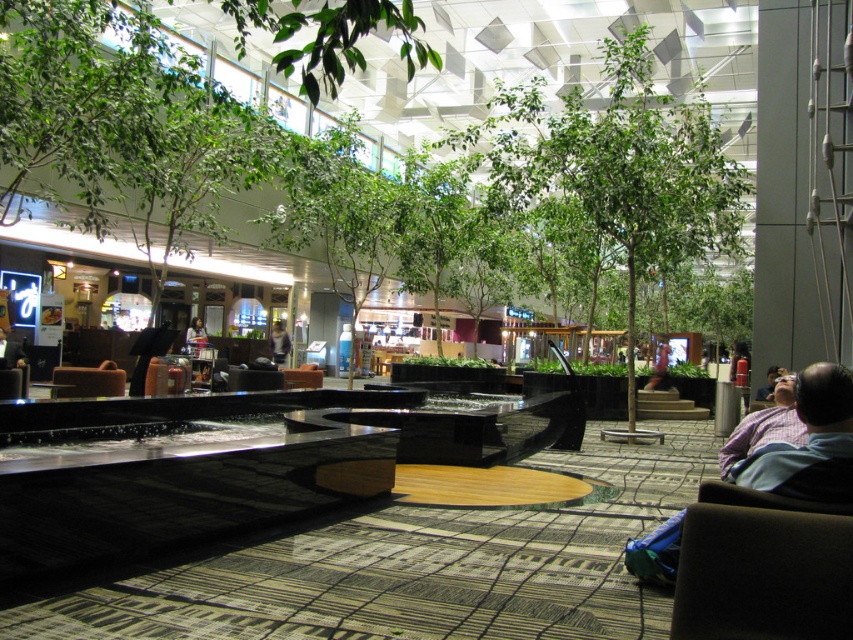
Looking at this image, can you confirm if brown fabric armchair at lower right is positioned to the left of smooth leather jacket at center?

Incorrect, brown fabric armchair at lower right is not on the left side of smooth leather jacket at center.

Does point (751, 524) lie behind point (206, 339)?

No, (751, 524) is closer to viewer.

Where is `brown fabric armchair at lower right`? The image size is (853, 640). brown fabric armchair at lower right is located at coordinates (762, 566).

Is light brown leather jacket at center thinner than smooth leather jacket at center?

Yes.

Is light brown leather jacket at center positioned in front of smooth leather jacket at center?

No, light brown leather jacket at center is further to the viewer.

Locate an element on the screen. light brown leather jacket at center is located at coordinates (277, 342).

Which is behind, point (822, 452) or point (103, 371)?

The point (103, 371) is behind.

The height and width of the screenshot is (640, 853). What do you see at coordinates (809, 444) in the screenshot?
I see `purple cotton shirt at lower right` at bounding box center [809, 444].

Which is behind, point (762, 458) or point (107, 387)?

The point (107, 387) is behind.

The width and height of the screenshot is (853, 640). Find the location of `purple cotton shirt at lower right`. purple cotton shirt at lower right is located at coordinates (809, 444).